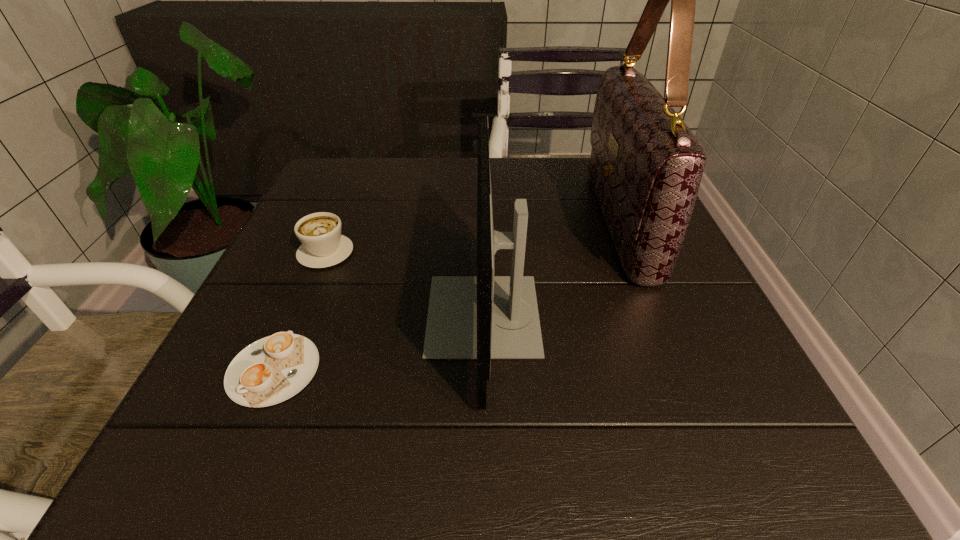
At what (x,y) coordinates should I click in order to perform the action: click on free location that satisfies the following two spatial constraints: 1. on the screen of the computer monitor; 2. on the front side of the shorter cappuccino. Please return your answer as a coordinate pair (x, y). Looking at the image, I should click on (484, 370).

Identify the location of vacant region that satisfies the following two spatial constraints: 1. on the front of the tallest object with the clasp; 2. on the front side of the nearer cappuccino. pos(680,370).

The image size is (960, 540). Identify the location of free location that satisfies the following two spatial constraints: 1. on the screen of the computer monitor; 2. on the front side of the nearer cappuccino. (484, 370).